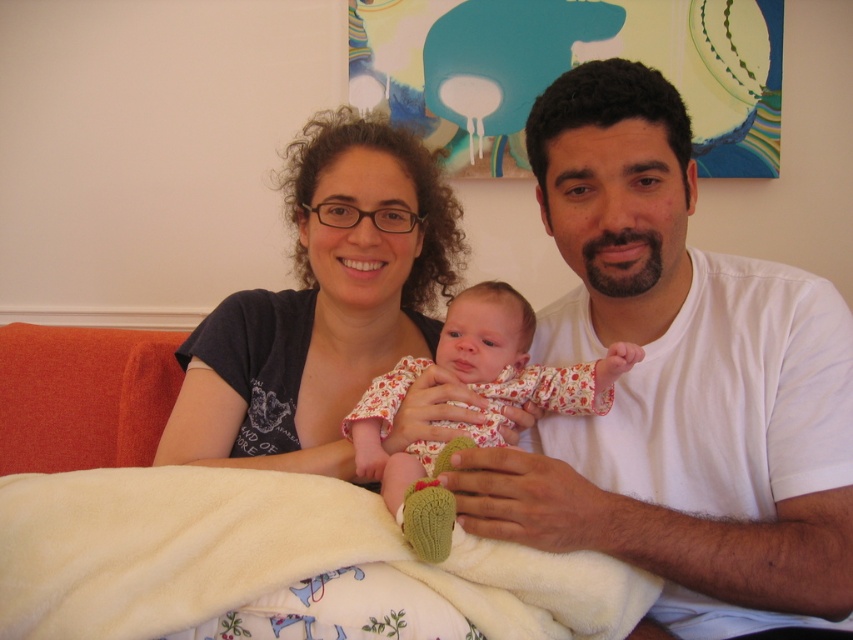
Question: Where is white cotton shirt at center located in relation to floral fabric baby at center in the image?

Choices:
 (A) below
 (B) above

Answer: (B)

Question: Is white cotton shirt at center thinner than matte black shirt at center?

Choices:
 (A) yes
 (B) no

Answer: (B)

Question: Which of the following is the closest to the observer?

Choices:
 (A) coord(453,488)
 (B) coord(315,454)
 (C) coord(91,593)

Answer: (C)

Question: Which is farther from the white cotton shirt at center?

Choices:
 (A) floral fabric baby at center
 (B) white soft blanket at lower center
 (C) matte black shirt at center

Answer: (C)

Question: Which object is closer to the camera taking this photo?

Choices:
 (A) white cotton shirt at center
 (B) matte black shirt at center
 (C) floral fabric baby at center
 (D) white soft blanket at lower center

Answer: (D)

Question: Does matte black shirt at center lie behind floral fabric baby at center?

Choices:
 (A) no
 (B) yes

Answer: (B)